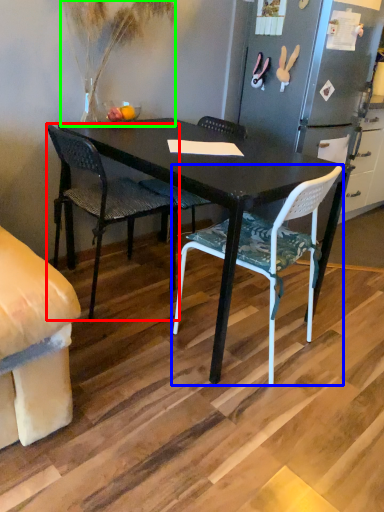
Question: Estimate the real-world distances between objects in this image. Which object is closer to chair (highlighted by a red box), chair (highlighted by a blue box) or houseplant (highlighted by a green box)?

Choices:
 (A) chair
 (B) houseplant

Answer: (B)